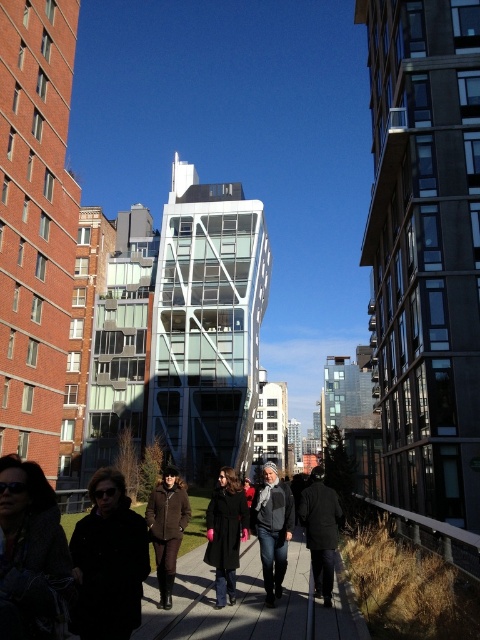
Question: Which of the following is the farthest from the observer?

Choices:
 (A) (210, 529)
 (B) (267, 470)

Answer: (B)

Question: Does dark gray knit scarf at center appear on the right side of brown wool coat at center?

Choices:
 (A) yes
 (B) no

Answer: (A)

Question: Which of the following is the farthest from the observer?

Choices:
 (A) (159, 554)
 (B) (312, 556)
 (C) (59, 548)

Answer: (B)

Question: Which point appears farthest from the camera in this image?

Choices:
 (A) (286, 577)
 (B) (325, 556)
 (C) (213, 531)
 (D) (179, 508)

Answer: (A)

Question: Is brown wool coat at center positioned before dark gray wool coat at center?

Choices:
 (A) yes
 (B) no

Answer: (A)

Question: In this image, where is wooden walkway at center located relative to black wool coat at center?

Choices:
 (A) left
 (B) right

Answer: (B)